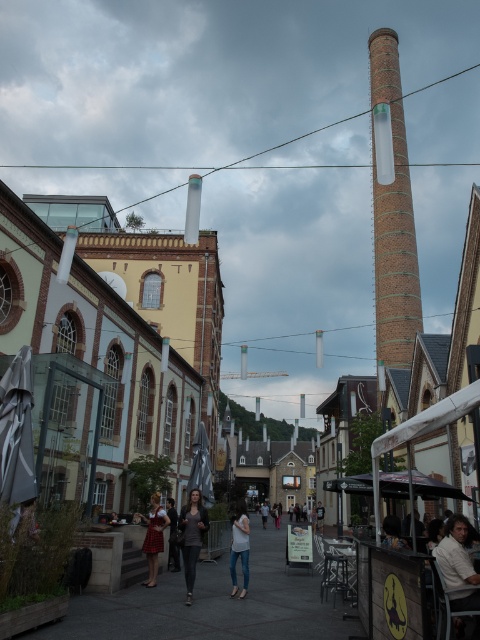
You are a photographer trying to capture the entire brick chimney at center and denim pants at center in one frame. Based on their sizes, which object should you focus on to ensure both are visible without cropping?

The brick chimney at center is larger in size than denim pants at center, so you should focus on the brick chimney at center to ensure both are visible without cropping.

You are a photographer standing in the middle of the street. You notice two outfits in the crowd at the center of the scene. The outfits are the red plaid skirt at center and the matte black dress at center. Which outfit is covering more of the other?

The red plaid skirt at center is positioned over matte black dress at center, so the red plaid skirt at center is covering the matte black dress at center.

You are standing at the point marked as point (240,547) in the image. Looking towards the tall brick chimney on the right, which direction should you walk to reach it?

The denim pants at center is located at point (240,547). Since the tall brick chimney is on the right side of the image, you should walk towards the right to reach it.